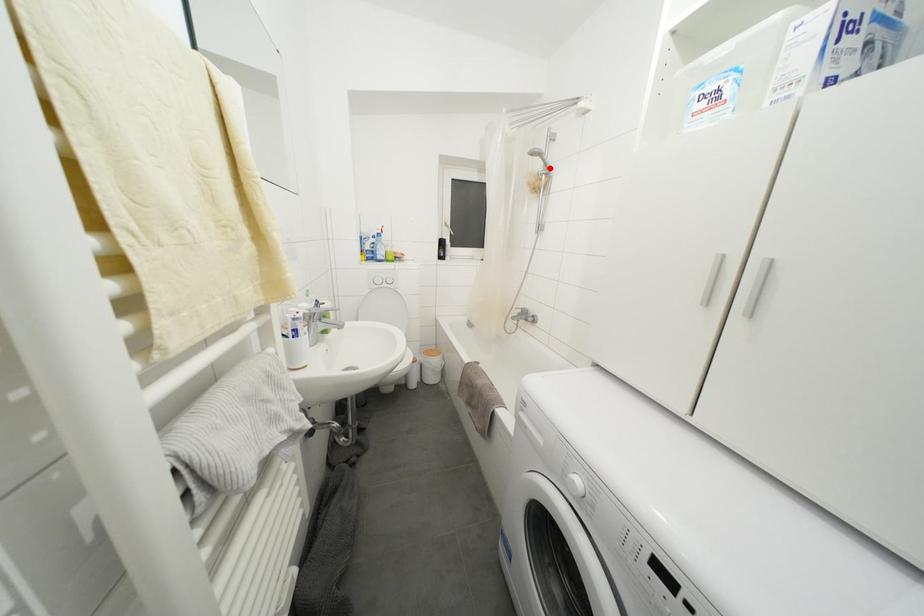
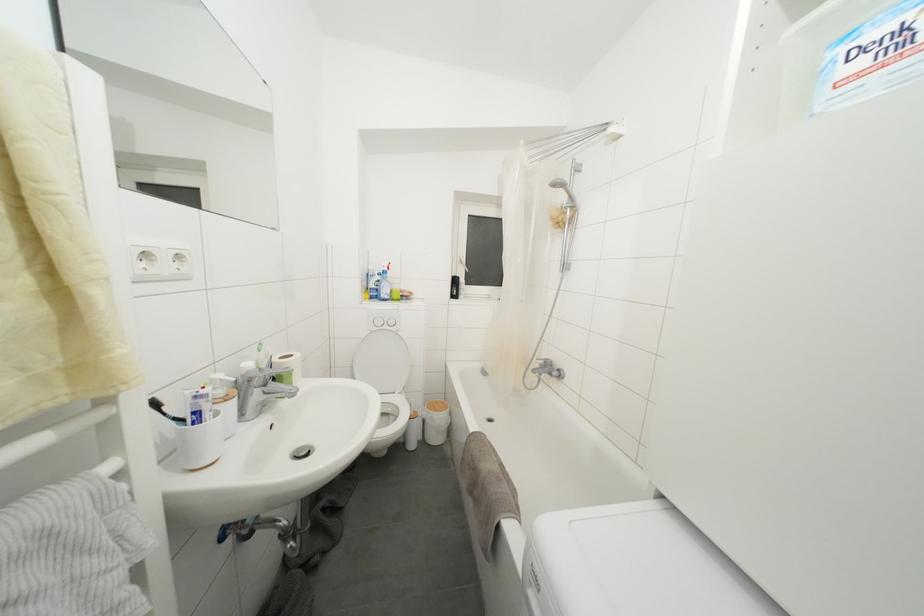
Find the pixel in the second image that matches the highlighted location in the first image.

(575, 200)